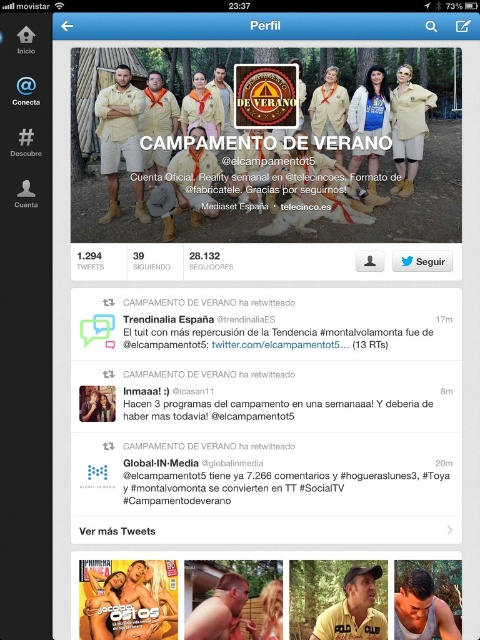
Question: Among these points, which one is nearest to the camera?

Choices:
 (A) pos(398,173)
 (B) pos(204,80)
 (C) pos(215,621)

Answer: (C)

Question: Considering the relative positions of beige cotton shirt at upper left and matte khaki shirt at center in the image provided, where is beige cotton shirt at upper left located with respect to matte khaki shirt at center?

Choices:
 (A) below
 (B) above

Answer: (A)

Question: Can you confirm if matte khaki uniform at center is positioned below wooden fence at center?

Choices:
 (A) no
 (B) yes

Answer: (A)

Question: Based on their relative distances, which object is nearer to the tan skin man at center?

Choices:
 (A) muscular tan torso at center
 (B) light beige fabric shirt at upper right

Answer: (A)

Question: Which is farther from the matte beige shirt at center?

Choices:
 (A) muscular tan torso at center
 (B) light beige fabric shirt at upper right
 (C) khaki cotton shirt at center
 (D) matte yellow shirt at center

Answer: (B)

Question: Is muscular tan torso at center wider than tan skin man at center?

Choices:
 (A) no
 (B) yes

Answer: (A)